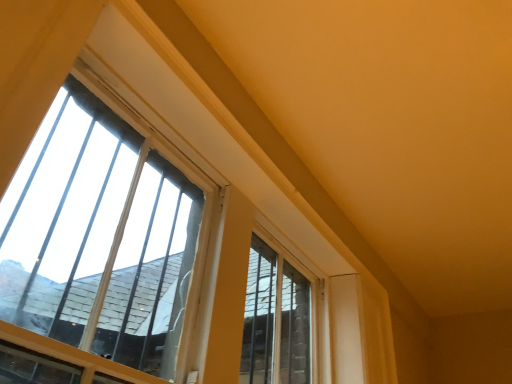
Image resolution: width=512 pixels, height=384 pixels. What do you see at coordinates (98, 237) in the screenshot?
I see `matte glass bay window at upper left` at bounding box center [98, 237].

From the picture: Measure the distance between matte glass bay window at upper left and camera.

A distance of 1.12 meters exists between matte glass bay window at upper left and camera.

Find the location of `matte glass bay window at upper left`. matte glass bay window at upper left is located at coordinates (98, 237).

The image size is (512, 384). I want to click on matte glass bay window at upper left, so click(x=98, y=237).